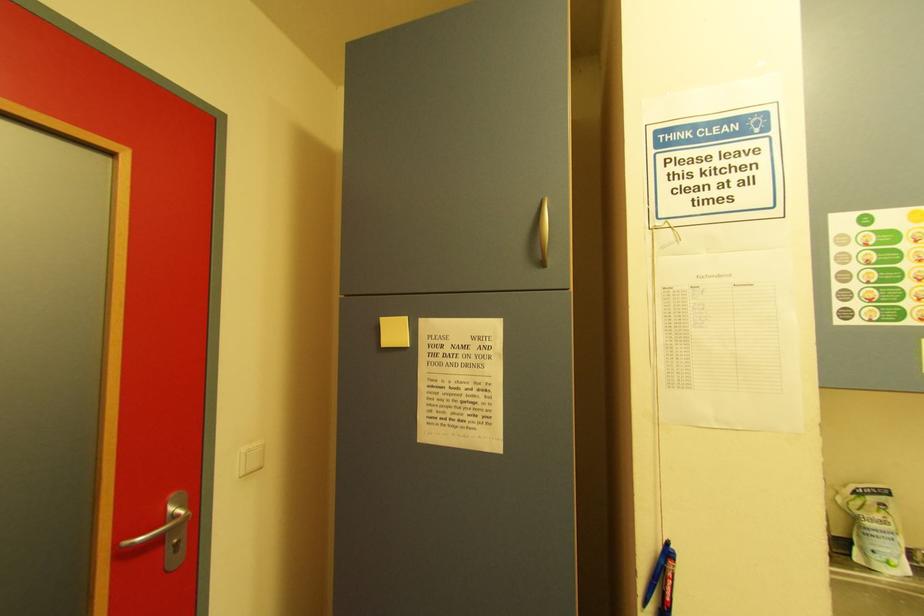
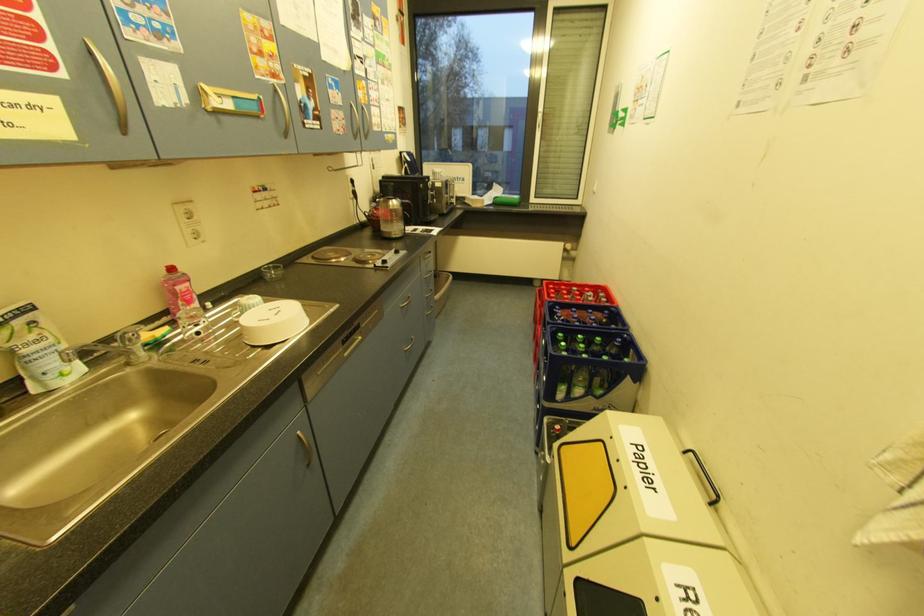
The first image is from the beginning of the video and the second image is from the end. How did the camera likely rotate when shooting the video?

The camera's rotation is toward right-down.